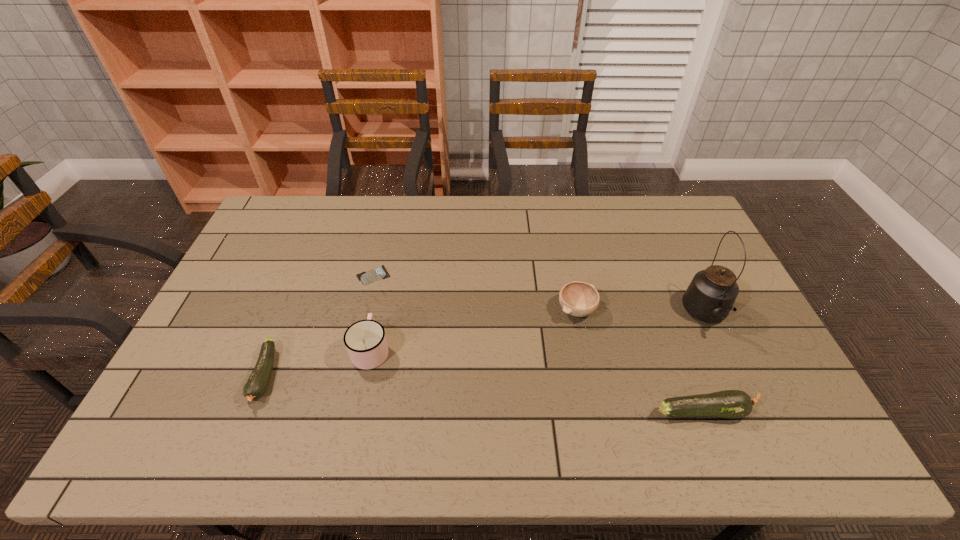
Please mark a free spot for a new zucchini to balance the arrangement. Please provide its 2D coordinates. Your answer should be formatted as a tuple, i.e. [(x, y)], where the tuple contains the x and y coordinates of a point satisfying the conditions above.

[(477, 393)]